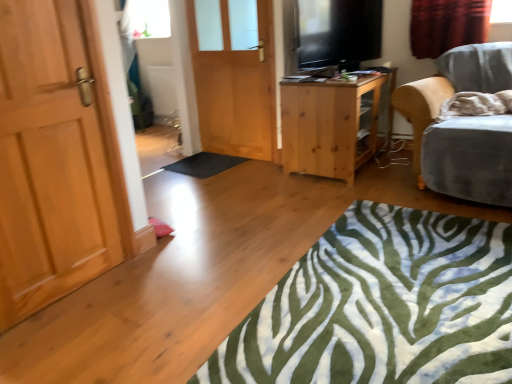
Question: From the image's perspective, is black rubber mat at center beneath velvet grey chair at right?

Choices:
 (A) no
 (B) yes

Answer: (B)

Question: From a real-world perspective, is black rubber mat at center under velvet grey chair at right?

Choices:
 (A) yes
 (B) no

Answer: (A)

Question: Is black rubber mat at center oriented away from velvet grey chair at right?

Choices:
 (A) yes
 (B) no

Answer: (B)

Question: Does black rubber mat at center appear on the left side of velvet grey chair at right?

Choices:
 (A) yes
 (B) no

Answer: (A)

Question: Does black rubber mat at center have a greater height compared to velvet grey chair at right?

Choices:
 (A) no
 (B) yes

Answer: (A)

Question: From a real-world perspective, is green zebra-patterned rug at lower center physically located above or below light brown wooden door at left, the 1th door from the left?

Choices:
 (A) above
 (B) below

Answer: (B)

Question: From the image's perspective, relative to light brown wooden door at left, positioned as the 1th door in front-to-back order, is green zebra-patterned rug at lower center above or below?

Choices:
 (A) above
 (B) below

Answer: (B)

Question: Based on their positions, is green zebra-patterned rug at lower center located to the left or right of light brown wooden door at left, arranged as the second door when viewed from the right?

Choices:
 (A) right
 (B) left

Answer: (A)

Question: Is green zebra-patterned rug at lower center bigger or smaller than light brown wooden door at left, the second door positioned from the back?

Choices:
 (A) big
 (B) small

Answer: (A)

Question: In terms of width, does red velvet curtain at upper right look wider or thinner when compared to flat screen tv at upper right?

Choices:
 (A) thin
 (B) wide

Answer: (B)

Question: From a real-world perspective, is red velvet curtain at upper right positioned above or below flat screen tv at upper right?

Choices:
 (A) below
 (B) above

Answer: (A)

Question: Considering the positions of point (437, 54) and point (314, 38), is point (437, 54) closer or farther from the camera than point (314, 38)?

Choices:
 (A) farther
 (B) closer

Answer: (A)

Question: Is red velvet curtain at upper right inside or outside of flat screen tv at upper right?

Choices:
 (A) inside
 (B) outside

Answer: (B)

Question: From the image's perspective, is velvet grey chair at right located above or below light brown wooden door at left, positioned as the 1th door in front-to-back order?

Choices:
 (A) above
 (B) below

Answer: (A)

Question: Considering their positions, is velvet grey chair at right located in front of or behind light brown wooden door at left, the 1th door from the left?

Choices:
 (A) behind
 (B) front

Answer: (A)